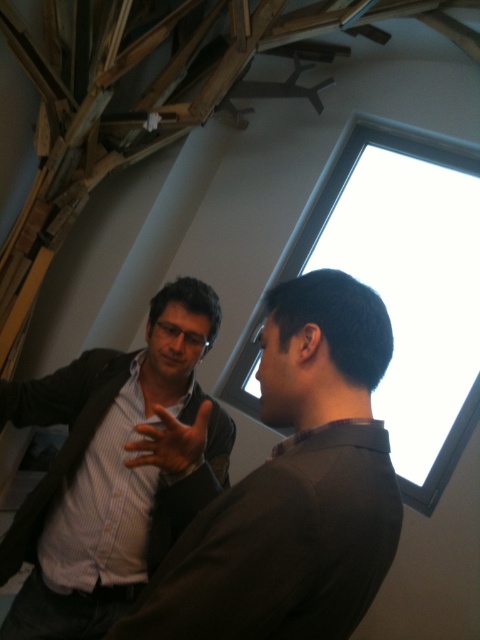
Question: Observing the image, what is the correct spatial positioning of dark brown shirt at center in reference to matte black hand at center?

Choices:
 (A) right
 (B) left

Answer: (A)

Question: Can you confirm if dark brown shirt at center is wider than matte black shirt at center?

Choices:
 (A) no
 (B) yes

Answer: (A)

Question: Can you confirm if matte black shirt at center is smaller than matte black hand at center?

Choices:
 (A) no
 (B) yes

Answer: (A)

Question: Estimate the real-world distances between objects in this image. Which object is farther from the dark brown shirt at center?

Choices:
 (A) matte black shirt at center
 (B) matte black hand at center

Answer: (A)

Question: Which of the following is the closest to the observer?

Choices:
 (A) matte black hand at center
 (B) dark brown shirt at center
 (C) matte black shirt at center

Answer: (B)

Question: Which point is farther from the camera taking this photo?

Choices:
 (A) (158, 465)
 (B) (158, 493)
 (C) (168, 554)

Answer: (B)